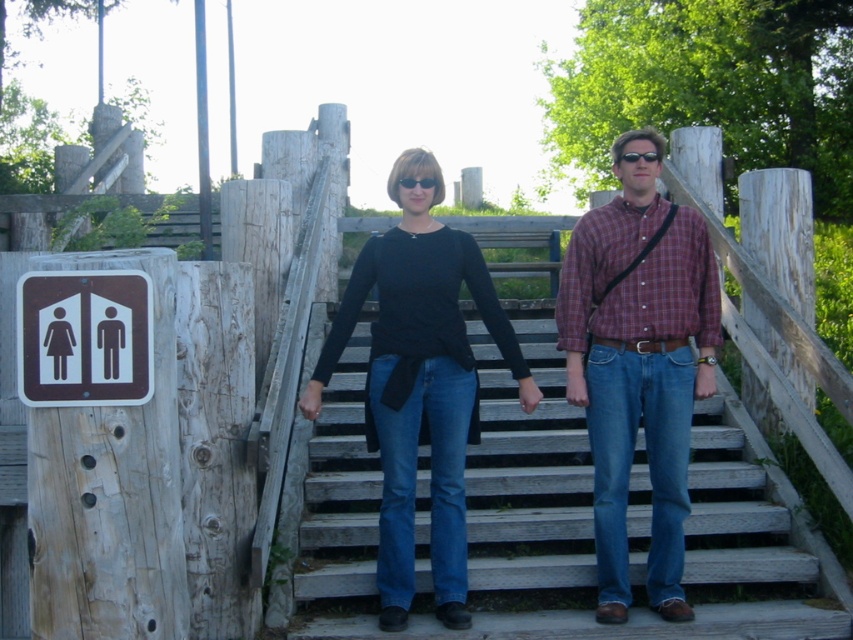
Question: Which of these objects is positioned closest to the brown plastic sign at left?

Choices:
 (A) wooden stairs at center
 (B) matte black shirt at center
 (C) plaid cotton shirt at center

Answer: (B)

Question: Does matte black shirt at center appear under brown plastic sign at left?

Choices:
 (A) no
 (B) yes

Answer: (B)

Question: Can you confirm if wooden stairs at center is wider than matte black shirt at center?

Choices:
 (A) yes
 (B) no

Answer: (A)

Question: Which of the following is the farthest from the observer?

Choices:
 (A) (828, 630)
 (B) (689, 276)

Answer: (B)

Question: Considering the real-world distances, which object is closest to the plaid cotton shirt at center?

Choices:
 (A) brown plastic sign at left
 (B) wooden stairs at center

Answer: (B)

Question: Does plaid cotton shirt at center appear on the right side of brown plastic sign at left?

Choices:
 (A) yes
 (B) no

Answer: (A)